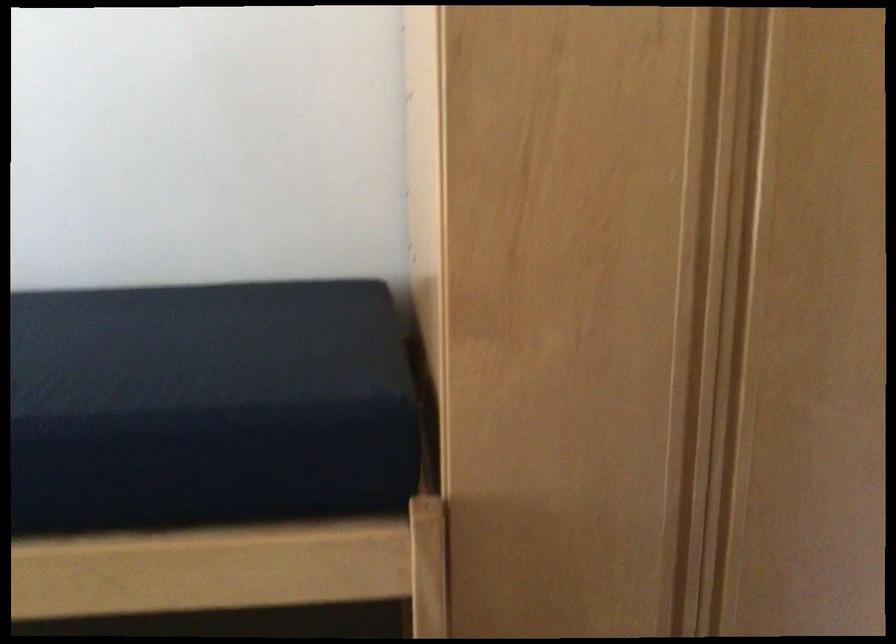
Where would you sit the chair sitting surface? Please return your answer as a coordinate pair (x, y).

(202, 346)